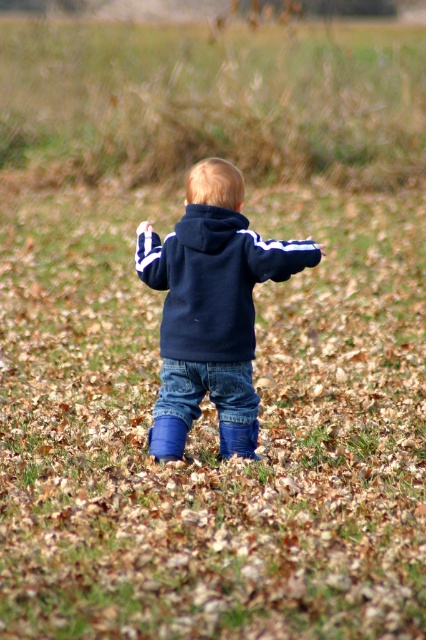
The scene shows a child in a grassy field pointing at something. You need to determine if the navy fleece hoodie at center is wider than the navy blue hoodie at center. Which one is wider?

The navy fleece hoodie at center is wider than the navy blue hoodie at center according to the description.

The child is wearing a navy fleece hoodie at center and denim jeans at center. Which piece of clothing is higher on the child?

The navy fleece hoodie at center is taller than the denim jeans at center, so the navy fleece hoodie at center is higher on the child.